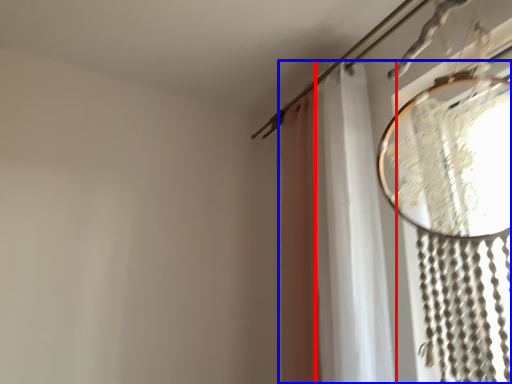
Question: Among these objects, which one is nearest to the camera, shower curtain (highlighted by a red box) or curtain (highlighted by a blue box)?

Choices:
 (A) shower curtain
 (B) curtain

Answer: (B)